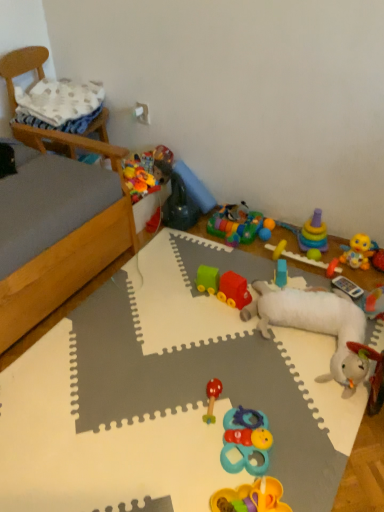
Find the location of a particular element. Image resolution: width=384 pixels, height=512 pixels. empty space that is to the right of rubberized red mushroom at center, which is counted as the ninth toy, starting from the top is located at coordinates (267, 395).